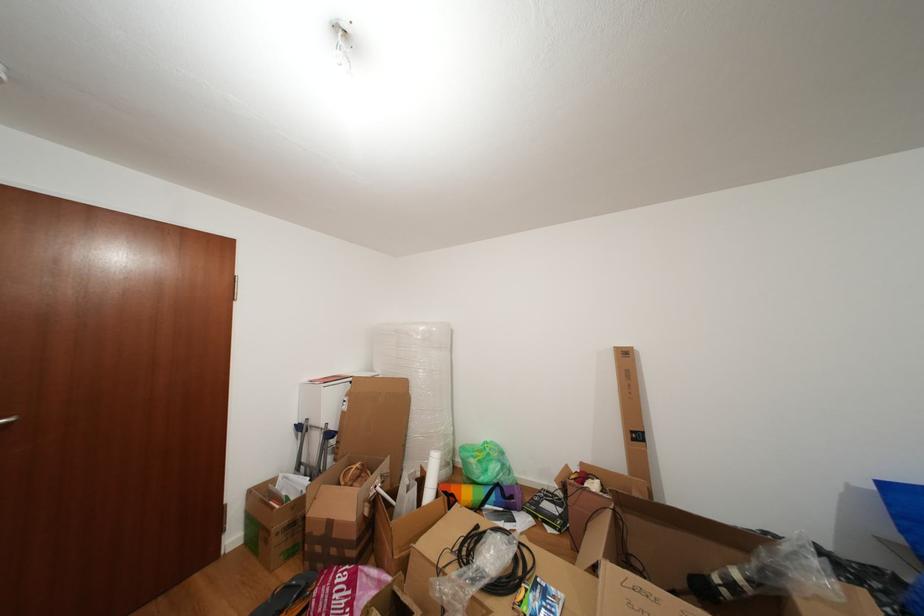
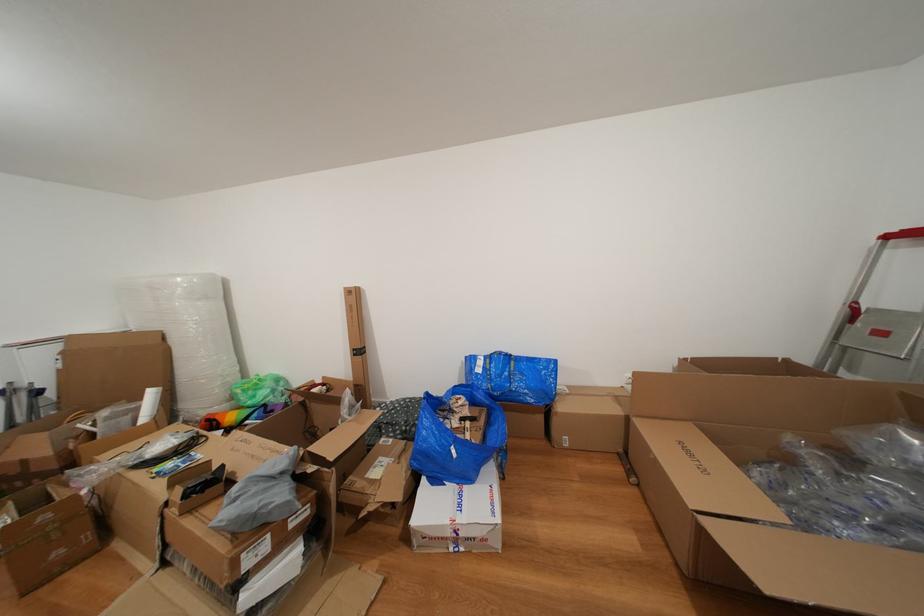
What movement of the cameraman would produce the second image?

The cameraman walked toward right, backward.